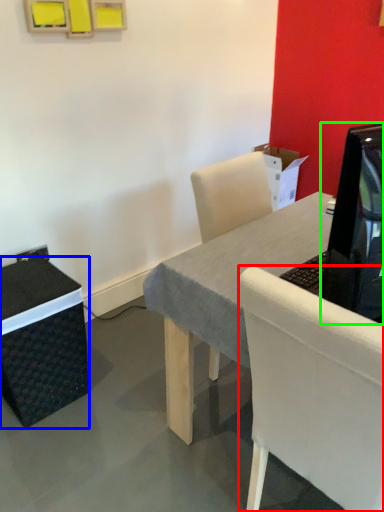
Question: Which is farther away from chair (highlighted by a red box)? box (highlighted by a blue box) or television (highlighted by a green box)?

Choices:
 (A) box
 (B) television

Answer: (A)